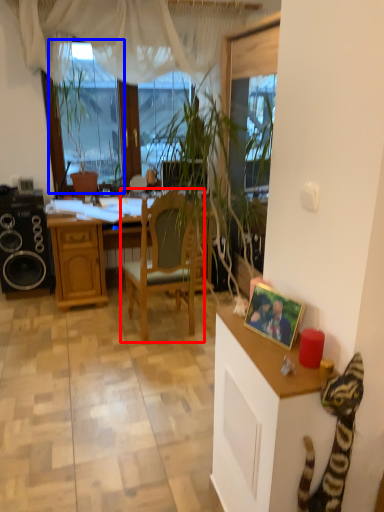
Question: Which object appears farthest to the camera in this image, chair (highlighted by a red box) or window screen (highlighted by a blue box)?

Choices:
 (A) chair
 (B) window screen

Answer: (B)